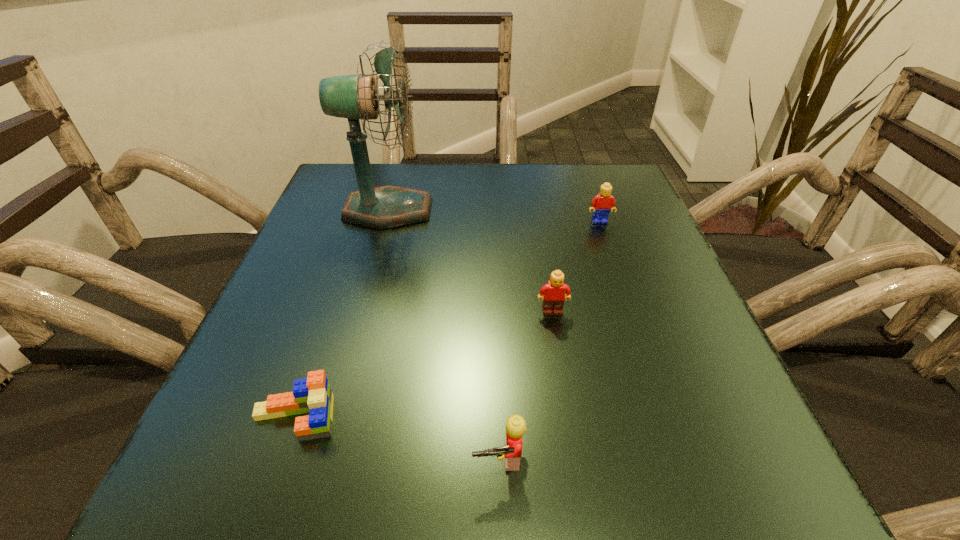
In order to click on free space located 0.150m on the face of the second object from right to left in this screenshot , I will do `click(565, 394)`.

In order to click on free space located on the back of the leftmost Lego in this screenshot , I will do `click(337, 296)`.

You are a GUI agent. You are given a task and a screenshot of the screen. Output one action in this format:
    pyautogui.click(x=<x>, y=<y>)
    Task: Click on the fan at the far edge
    Image resolution: width=960 pixels, height=540 pixels.
    Given the screenshot: What is the action you would take?
    pyautogui.click(x=354, y=97)

Where is `Lego that is at the far edge`? This screenshot has width=960, height=540. Lego that is at the far edge is located at coordinates (601, 204).

The width and height of the screenshot is (960, 540). What are the coordinates of `fan that is positioned at the left edge` in the screenshot? It's located at (354, 97).

Find the location of a particular element. This screenshot has width=960, height=540. Lego located at the left edge is located at coordinates (313, 395).

The width and height of the screenshot is (960, 540). Find the location of `object present at the right edge`. object present at the right edge is located at coordinates (601, 204).

Find the location of a particular element. object present at the far left corner is located at coordinates (354, 97).

At what (x,y) coordinates should I click in order to perform the action: click on object positioned at the near left corner. Please return your answer as a coordinate pair (x, y). The image size is (960, 540). Looking at the image, I should click on (313, 395).

What are the coordinates of `object at the far right corner` in the screenshot? It's located at (601, 204).